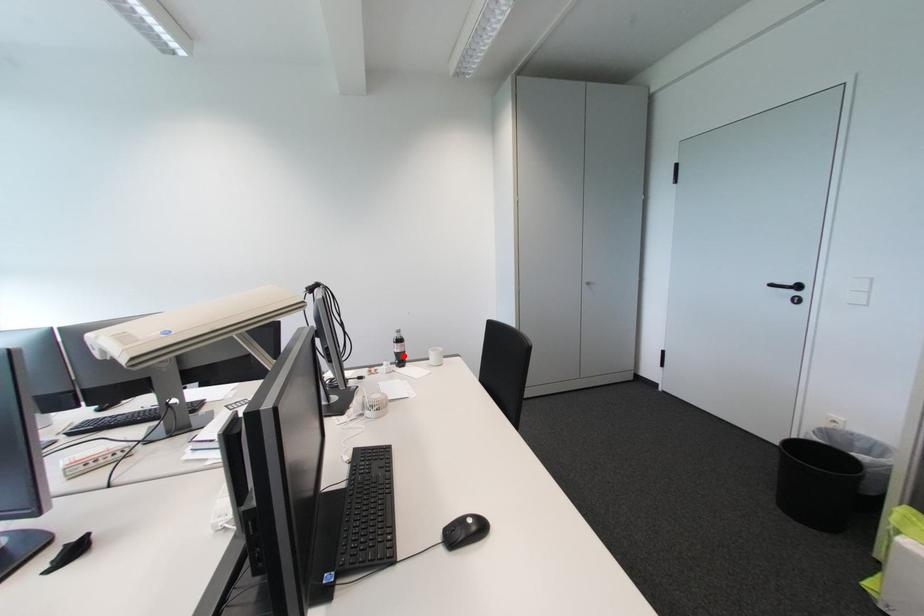
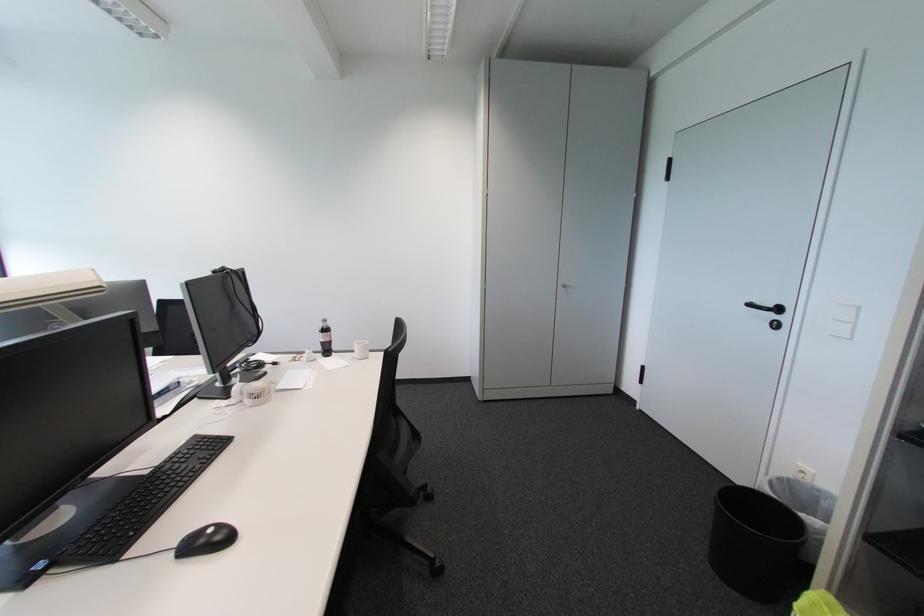
The point at the highlighted location is marked in the first image. Where is the corresponding point in the second image?

(330, 345)